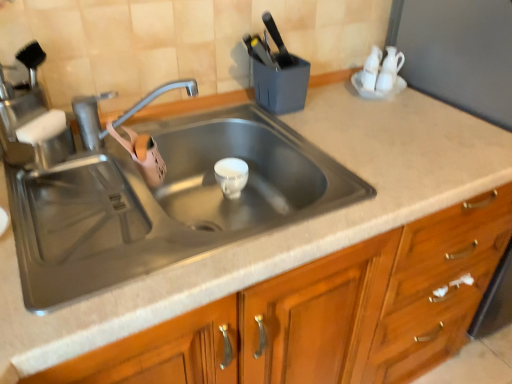
Question: Considering the relative sizes of wooden cabinet at center and stainless steel sink at center in the image provided, is wooden cabinet at center thinner than stainless steel sink at center?

Choices:
 (A) yes
 (B) no

Answer: (B)

Question: Is wooden cabinet at center placed right next to stainless steel sink at center?

Choices:
 (A) no
 (B) yes

Answer: (A)

Question: From the image's perspective, does wooden cabinet at center appear lower than stainless steel sink at center?

Choices:
 (A) yes
 (B) no

Answer: (A)

Question: Is wooden cabinet at center further to the viewer compared to stainless steel sink at center?

Choices:
 (A) yes
 (B) no

Answer: (B)

Question: Is wooden cabinet at center to the left of stainless steel sink at center from the viewer's perspective?

Choices:
 (A) no
 (B) yes

Answer: (A)

Question: Is satin nickel faucet at upper left inside the boundaries of stainless steel sink at center, or outside?

Choices:
 (A) inside
 (B) outside

Answer: (B)

Question: From a real-world perspective, is satin nickel faucet at upper left physically located above or below stainless steel sink at center?

Choices:
 (A) below
 (B) above

Answer: (B)

Question: Looking at the image, does satin nickel faucet at upper left seem bigger or smaller compared to stainless steel sink at center?

Choices:
 (A) small
 (B) big

Answer: (A)

Question: In terms of width, does satin nickel faucet at upper left look wider or thinner when compared to stainless steel sink at center?

Choices:
 (A) wide
 (B) thin

Answer: (B)

Question: Is wooden cabinet at center situated inside satin nickel faucet at upper left or outside?

Choices:
 (A) outside
 (B) inside

Answer: (A)

Question: Does point (412, 289) appear closer or farther from the camera than point (117, 120)?

Choices:
 (A) farther
 (B) closer

Answer: (B)

Question: From the image's perspective, relative to satin nickel faucet at upper left, is wooden cabinet at center above or below?

Choices:
 (A) below
 (B) above

Answer: (A)

Question: Is wooden cabinet at center taller or shorter than satin nickel faucet at upper left?

Choices:
 (A) short
 (B) tall

Answer: (B)

Question: Considering their positions, is satin nickel faucet at upper left located in front of or behind wooden cabinet at center?

Choices:
 (A) behind
 (B) front

Answer: (A)

Question: Based on their positions, is satin nickel faucet at upper left located to the left or right of wooden cabinet at center?

Choices:
 (A) right
 (B) left

Answer: (B)